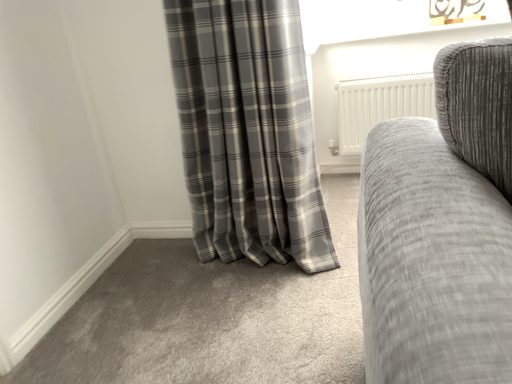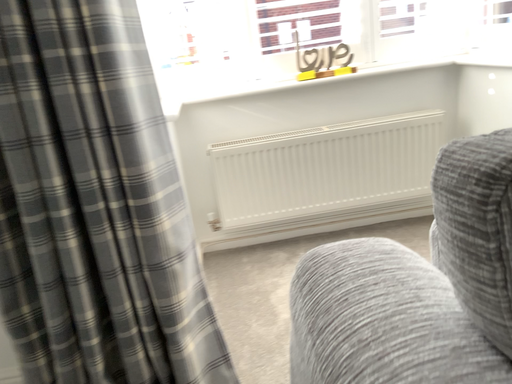
Question: How did the camera likely rotate when shooting the video?

Choices:
 (A) rotated upward
 (B) rotated downward

Answer: (A)